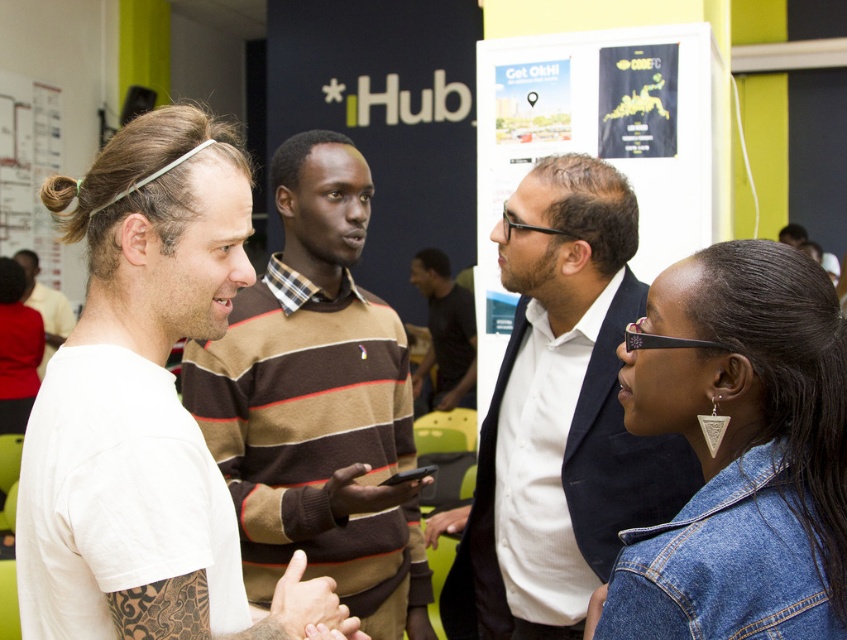
Question: Considering the relative positions of denim jacket at lower right and dark blue suit at center in the image provided, where is denim jacket at lower right located with respect to dark blue suit at center?

Choices:
 (A) above
 (B) below

Answer: (A)

Question: Which of the following is the farthest from the observer?

Choices:
 (A) (25, 275)
 (B) (145, 472)

Answer: (A)

Question: Does white t-shirt at center appear over dark blue suit at center?

Choices:
 (A) no
 (B) yes

Answer: (B)

Question: Which object appears farthest from the camera in this image?

Choices:
 (A) brown striped sweater at center
 (B) white t-shirt at center
 (C) black matte shirt at center

Answer: (C)

Question: Can you confirm if brown striped sweater at center is bigger than black matte shirt at center?

Choices:
 (A) no
 (B) yes

Answer: (A)

Question: Which of the following is the farthest from the observer?

Choices:
 (A) (447, 348)
 (B) (399, 612)
 (C) (192, 552)
 (D) (25, 250)

Answer: (D)